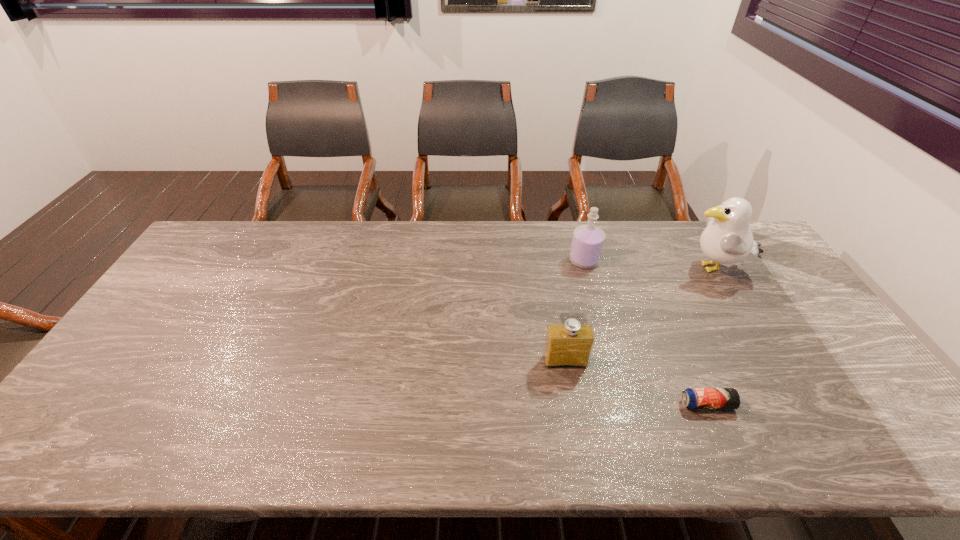
The height and width of the screenshot is (540, 960). Find the location of `vacant point located between the nearest object and the gull`. vacant point located between the nearest object and the gull is located at coordinates (x=710, y=337).

Image resolution: width=960 pixels, height=540 pixels. I want to click on vacant area between the rightmost object and the taller perfume, so click(649, 265).

You are a GUI agent. You are given a task and a screenshot of the screen. Output one action in this format:
    pyautogui.click(x=<x>, y=<y>)
    Task: Click on the vacant area between the nearest object and the rightmost object
    This screenshot has height=540, width=960.
    Given the screenshot: What is the action you would take?
    pyautogui.click(x=710, y=337)

Point out which object is positioned as the third nearest to the leftmost object. Please provide its 2D coordinates. Your answer should be formatted as a tuple, i.e. [(x, y)], where the tuple contains the x and y coordinates of a point satisfying the conditions above.

[(727, 239)]

Identify which object is the third nearest to the left perfume. Please provide its 2D coordinates. Your answer should be formatted as a tuple, i.e. [(x, y)], where the tuple contains the x and y coordinates of a point satisfying the conditions above.

[(727, 239)]

Where is `free spot that satisfies the following two spatial constraints: 1. on the front-facing side of the nearest object; 2. on the right side of the nearer perfume`? free spot that satisfies the following two spatial constraints: 1. on the front-facing side of the nearest object; 2. on the right side of the nearer perfume is located at coordinates (573, 404).

At what (x,y) coordinates should I click in order to perform the action: click on vacant space that satisfies the following two spatial constraints: 1. on the beak of the rightmost object; 2. on the front-facing side of the nearer perfume. Please return your answer as a coordinate pair (x, y). This screenshot has height=540, width=960. Looking at the image, I should click on (769, 361).

Where is `free space that satisfies the following two spatial constraints: 1. on the beak of the rightmost object; 2. on the front-facing side of the second nearest object`? The height and width of the screenshot is (540, 960). free space that satisfies the following two spatial constraints: 1. on the beak of the rightmost object; 2. on the front-facing side of the second nearest object is located at coordinates (769, 361).

At what (x,y) coordinates should I click in order to perform the action: click on free space that satisfies the following two spatial constraints: 1. on the beak of the gull; 2. on the front-facing side of the nearer perfume. Please return your answer as a coordinate pair (x, y). This screenshot has width=960, height=540. Looking at the image, I should click on (769, 361).